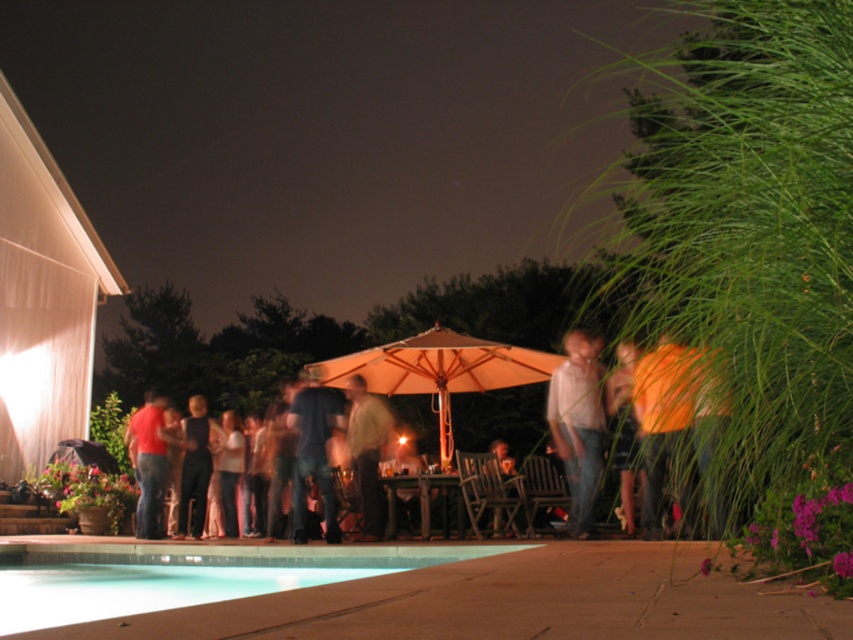
Based on the photo, you are at a party and want to find someone wearing light brown denim jeans at center and matte red shirt at left. Which one of these items of clothing is larger in size?

The matte red shirt at left is larger than the light brown denim jeans at center.

You are standing at the point labeled point (381, 364) and want to move towards the point labeled point (299, 515). Will you be moving forward or backward relative to your current position?

Since point (381, 364) is behind point (299, 515), moving towards point (299, 515) would mean moving forward relative to your current position at point (381, 364).

You are at the poolside dinner and want to know if the beige fabric umbrella at center can provide shade for the denim jeans at center. Based on their heights, can it?

The beige fabric umbrella at center is taller than denim jeans at center, so yes, the umbrella can provide shade for the denim jeans at center.